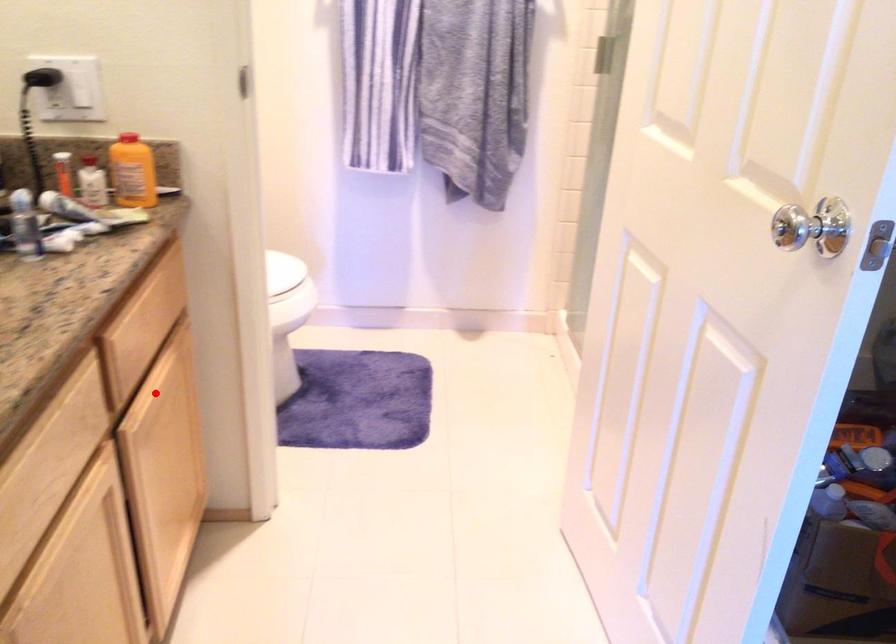
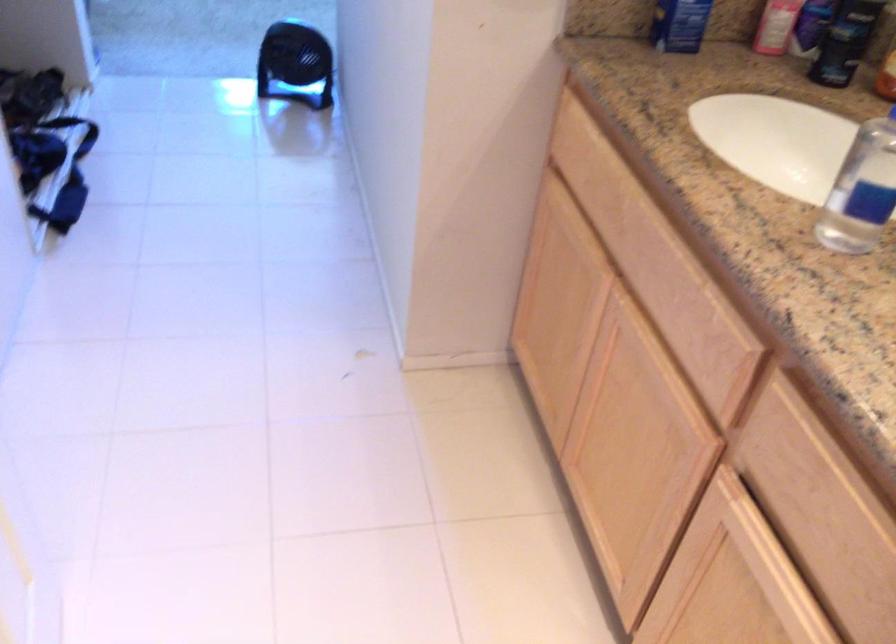
Where in the second image is the point corresponding to the highlighted location from the first image?

(754, 536)